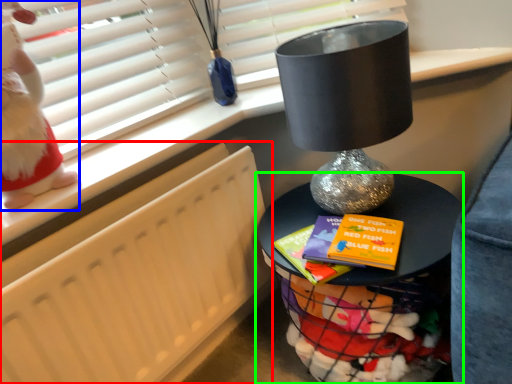
Question: Which object is positioned closest to radiator (highlighted by a red box)? Select from doll (highlighted by a blue box) and furniture (highlighted by a green box).

Choices:
 (A) doll
 (B) furniture

Answer: (A)